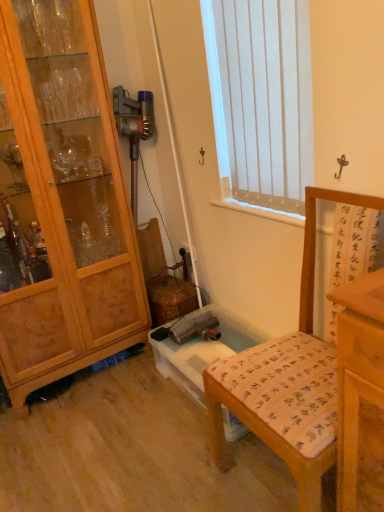
Question: Based on their positions, is wooden chair with printed cushion at lower right located to the left or right of wooden cabinet at left?

Choices:
 (A) right
 (B) left

Answer: (A)

Question: Considering the positions of wooden chair with printed cushion at lower right and wooden cabinet at left in the image, is wooden chair with printed cushion at lower right bigger or smaller than wooden cabinet at left?

Choices:
 (A) small
 (B) big

Answer: (A)

Question: Which object is positioned farthest from the white vertical blinds at upper center?

Choices:
 (A) wooden cabinet at left
 (B) wooden chair with printed cushion at lower right

Answer: (B)

Question: Which of these objects is positioned closest to the wooden chair with printed cushion at lower right?

Choices:
 (A) white vertical blinds at upper center
 (B) wooden cabinet at left

Answer: (A)